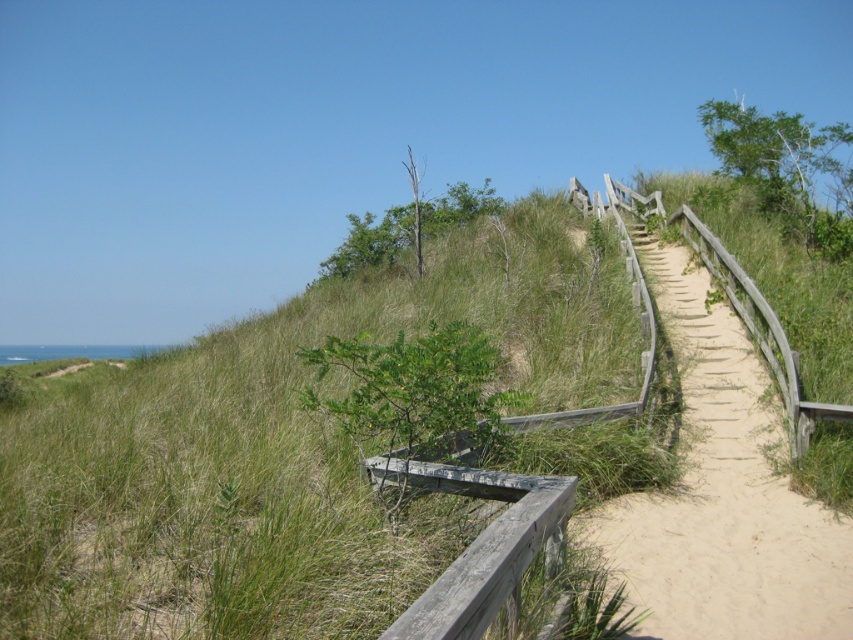
You are a hiker who wants to take a photo of the green grassy at upper center and the wooden boardwalk at upper right. Which object should you focus on first if you want to capture both in one frame without moving the camera?

The green grassy at upper center is above the wooden boardwalk at upper right, so you should focus on the green grassy at upper center first to ensure both are in the frame.

You are standing at the point with coordinates 0.6, 0.3 in this coastal scene. Looking towards the green grassy at upper center located at 0.703, 0.331, will you see the ocean behind it?

The green grassy at upper center is positioned at (281, 449). Since the ocean is in the background of the scene, the green grassy at upper center would block your view of the ocean when looking in that direction.

You are standing on the wooden boardwalk at upper right and want to walk towards the green grassy area at upper center. Which direction should you move to get closer to the green grassy at upper center?

Since the green grassy at upper center is closer to the viewer than the wooden boardwalk at upper right, you should move backward or towards the direction away from the ocean to reach the green grassy at upper center.